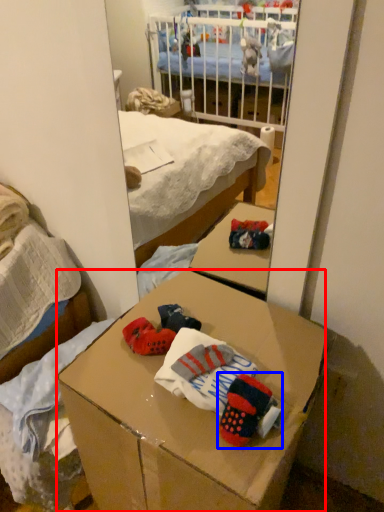
Question: Which object appears closest to the camera in this image, desk (highlighted by a red box) or toy (highlighted by a blue box)?

Choices:
 (A) desk
 (B) toy

Answer: (A)